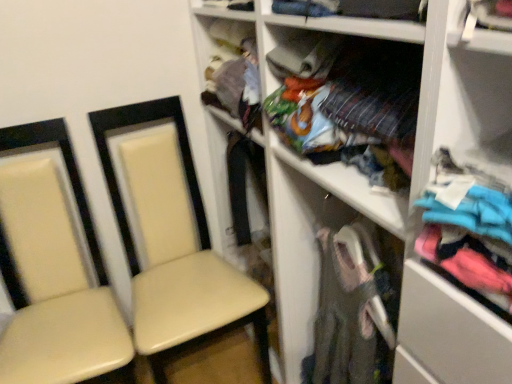
The height and width of the screenshot is (384, 512). What do you see at coordinates (467, 228) in the screenshot?
I see `turquoise fabric shirt at right, which is counted as the second clothing, starting from the back` at bounding box center [467, 228].

This screenshot has height=384, width=512. I want to click on beige leather chair at left, which is the second chair from left to right, so coord(173,240).

Where is `turquoise fabric shirt at right, the first clothing positioned from the front`? This screenshot has height=384, width=512. turquoise fabric shirt at right, the first clothing positioned from the front is located at coordinates (467, 228).

From the image's perspective, is matte white shelf at center positioned above or below multicolored fabric at center, acting as the 2th clothing starting from the front?

matte white shelf at center is below multicolored fabric at center, acting as the 2th clothing starting from the front.

Is matte white shelf at center to the left or to the right of multicolored fabric at center, acting as the 2th clothing starting from the front, in the image?

A: matte white shelf at center is positioned on multicolored fabric at center, acting as the 2th clothing starting from the front,'s right side.

Would you say matte white shelf at center is outside multicolored fabric at center, acting as the 2th clothing starting from the front?

That's correct, matte white shelf at center is outside of multicolored fabric at center, acting as the 2th clothing starting from the front.

Between matte white shelf at center and multicolored fabric at center, acting as the 2th clothing starting from the front, which one has larger size?

matte white shelf at center is bigger.

Can you confirm if textured fabric clothing at upper center is taller than beige leather chair at left, the 1th chair positioned from the left?

Incorrect, the height of textured fabric clothing at upper center is not larger of that of beige leather chair at left, the 1th chair positioned from the left.

Can you confirm if textured fabric clothing at upper center is positioned to the left of beige leather chair at left, the 1th chair positioned from the left?

Incorrect, textured fabric clothing at upper center is not on the left side of beige leather chair at left, the 1th chair positioned from the left.

Does point (257, 138) come behind point (79, 311)?

No, it is in front of (79, 311).

How much distance is there between beige leather chair at left, which is the second chair from left to right, and turquoise fabric shirt at right, which is counted as the second clothing, starting from the back?

beige leather chair at left, which is the second chair from left to right, and turquoise fabric shirt at right, which is counted as the second clothing, starting from the back, are 3.36 feet apart.

Is beige leather chair at left, which is the second chair from left to right, next to turquoise fabric shirt at right, the first clothing positioned from the front, and touching it?

No, beige leather chair at left, which is the second chair from left to right, is not in contact with turquoise fabric shirt at right, the first clothing positioned from the front.

How many degrees apart are the facing directions of beige leather chair at left, which is the second chair from left to right, and turquoise fabric shirt at right, which is counted as the second clothing, starting from the back?

beige leather chair at left, which is the second chair from left to right, and turquoise fabric shirt at right, which is counted as the second clothing, starting from the back, are facing 93.3 degrees away from each other.

Is beige leather chair at left, which is the second chair from left to right, completely or partially outside of turquoise fabric shirt at right, which is counted as the second clothing, starting from the back?

beige leather chair at left, which is the second chair from left to right, is positioned outside turquoise fabric shirt at right, which is counted as the second clothing, starting from the back.

Is beige leather chair at left, acting as the 2th chair starting from the right, at the back of beige leather chair at left, which is the second chair from left to right?

beige leather chair at left, which is the second chair from left to right, is not turned away from beige leather chair at left, acting as the 2th chair starting from the right.

Visually, is beige leather chair at left, placed as the first chair when sorted from right to left, positioned to the left or to the right of beige leather chair at left, acting as the 2th chair starting from the right?

beige leather chair at left, placed as the first chair when sorted from right to left, is to the right of beige leather chair at left, acting as the 2th chair starting from the right.

Is beige leather chair at left, which is the second chair from left to right, situated inside beige leather chair at left, acting as the 2th chair starting from the right, or outside?

beige leather chair at left, which is the second chair from left to right, is outside beige leather chair at left, acting as the 2th chair starting from the right.

Are beige leather chair at left, placed as the first chair when sorted from right to left, and beige leather chair at left, acting as the 2th chair starting from the right, located far from each other?

beige leather chair at left, placed as the first chair when sorted from right to left, is actually quite close to beige leather chair at left, acting as the 2th chair starting from the right.

Looking at this image, from the image's perspective, which one is positioned higher, multicolored fabric at center, acting as the 1th clothing starting from the back, or beige leather chair at left, which is the second chair from left to right?

multicolored fabric at center, acting as the 1th clothing starting from the back, appears higher in the image.

Is multicolored fabric at center, acting as the 1th clothing starting from the back, oriented away from beige leather chair at left, placed as the first chair when sorted from right to left?

No, multicolored fabric at center, acting as the 1th clothing starting from the back, is not facing the opposite direction of beige leather chair at left, placed as the first chair when sorted from right to left.

Does multicolored fabric at center, acting as the 2th clothing starting from the front, have a smaller size compared to beige leather chair at left, which is the second chair from left to right?

Correct, multicolored fabric at center, acting as the 2th clothing starting from the front, occupies less space than beige leather chair at left, which is the second chair from left to right.

How many degrees apart are the facing directions of multicolored fabric at center, acting as the 1th clothing starting from the back, and beige leather chair at left, which is the second chair from left to right?

They differ by 93.3 degrees in their facing directions.

Can you confirm if beige leather chair at left, acting as the 2th chair starting from the right, is taller than multicolored fabric at center, acting as the 2th clothing starting from the front?

Indeed, beige leather chair at left, acting as the 2th chair starting from the right, has a greater height compared to multicolored fabric at center, acting as the 2th clothing starting from the front.

From a real-world perspective, who is located higher, beige leather chair at left, acting as the 2th chair starting from the right, or multicolored fabric at center, acting as the 2th clothing starting from the front?

multicolored fabric at center, acting as the 2th clothing starting from the front.

Is beige leather chair at left, the 1th chair positioned from the left, positioned far away from multicolored fabric at center, acting as the 1th clothing starting from the back?

They are positioned close to each other.

Is beige leather chair at left, the 1th chair positioned from the left, to the right of multicolored fabric at center, acting as the 1th clothing starting from the back, from the viewer's perspective?

Incorrect, beige leather chair at left, the 1th chair positioned from the left, is not on the right side of multicolored fabric at center, acting as the 1th clothing starting from the back.

Is beige leather chair at left, which is the second chair from left to right, bigger or smaller than textured fabric clothing at upper center?

In the image, beige leather chair at left, which is the second chair from left to right, appears to be larger than textured fabric clothing at upper center.

Is textured fabric clothing at upper center at the back of beige leather chair at left, placed as the first chair when sorted from right to left?

beige leather chair at left, placed as the first chair when sorted from right to left, does not have its back to textured fabric clothing at upper center.

What's the angular difference between beige leather chair at left, which is the second chair from left to right, and textured fabric clothing at upper center's facing directions?

They differ by 93.3 degrees in their facing directions.

Which is in front, beige leather chair at left, placed as the first chair when sorted from right to left, or textured fabric clothing at upper center?

beige leather chair at left, placed as the first chair when sorted from right to left.

Locate an element on the screen. The image size is (512, 384). the 2nd clothing above the matte white shelf at center (from the image's perspective) is located at coordinates (348, 102).

Locate an element on the screen. cabinet behind the beige leather chair at left, acting as the 2th chair starting from the right is located at coordinates (231, 64).

From the image, which object appears to be nearer to turquoise fabric shirt at right, which is counted as the second clothing, starting from the back, beige leather chair at left, which is the second chair from left to right, or beige leather chair at left, acting as the 2th chair starting from the right?

beige leather chair at left, which is the second chair from left to right, is closer to turquoise fabric shirt at right, which is counted as the second clothing, starting from the back.

In the scene shown: Considering their positions, is textured fabric clothing at upper center positioned further to matte white shelf at center than multicolored fabric at center, acting as the 1th clothing starting from the back?

Among the two, textured fabric clothing at upper center is located further to matte white shelf at center.

Looking at the image, which one is located closer to beige leather chair at left, acting as the 2th chair starting from the right, beige leather chair at left, which is the second chair from left to right, or textured fabric clothing at upper center?

beige leather chair at left, which is the second chair from left to right, is closer to beige leather chair at left, acting as the 2th chair starting from the right.

When comparing their distances from multicolored fabric at center, acting as the 1th clothing starting from the back, does textured fabric clothing at upper center or beige leather chair at left, the 1th chair positioned from the left, seem closer?

The object closer to multicolored fabric at center, acting as the 1th clothing starting from the back, is textured fabric clothing at upper center.

Based on their spatial positions, is multicolored fabric at center, acting as the 1th clothing starting from the back, or turquoise fabric shirt at right, which is counted as the second clothing, starting from the back, closer to beige leather chair at left, the 1th chair positioned from the left?

The object closer to beige leather chair at left, the 1th chair positioned from the left, is multicolored fabric at center, acting as the 1th clothing starting from the back.

When comparing their distances from turquoise fabric shirt at right, the first clothing positioned from the front, does matte white shelf at center or beige leather chair at left, acting as the 2th chair starting from the right, seem closer?

matte white shelf at center is closer to turquoise fabric shirt at right, the first clothing positioned from the front.

In the scene shown: Based on their spatial positions, is beige leather chair at left, acting as the 2th chair starting from the right, or textured fabric clothing at upper center closer to multicolored fabric at center, acting as the 2th clothing starting from the front?

textured fabric clothing at upper center is closer to multicolored fabric at center, acting as the 2th clothing starting from the front.

When comparing their distances from beige leather chair at left, acting as the 2th chair starting from the right, does textured fabric clothing at upper center or turquoise fabric shirt at right, which is counted as the second clothing, starting from the back, seem further?

The object further to beige leather chair at left, acting as the 2th chair starting from the right, is turquoise fabric shirt at right, which is counted as the second clothing, starting from the back.

I want to click on cabinet between beige leather chair at left, the 1th chair positioned from the left, and turquoise fabric shirt at right, which is counted as the second clothing, starting from the back, in the horizontal direction, so click(231, 64).

Locate an element on the screen. The width and height of the screenshot is (512, 384). chair between beige leather chair at left, the 1th chair positioned from the left, and turquoise fabric shirt at right, the first clothing positioned from the front, in the horizontal direction is located at coordinates (173, 240).

Locate an element on the screen. shelf between beige leather chair at left, which is the second chair from left to right, and turquoise fabric shirt at right, the first clothing positioned from the front, in the horizontal direction is located at coordinates (387, 195).

Where is `chair between textured fabric clothing at upper center and beige leather chair at left, acting as the 2th chair starting from the right, vertically`? The height and width of the screenshot is (384, 512). chair between textured fabric clothing at upper center and beige leather chair at left, acting as the 2th chair starting from the right, vertically is located at coordinates (173, 240).